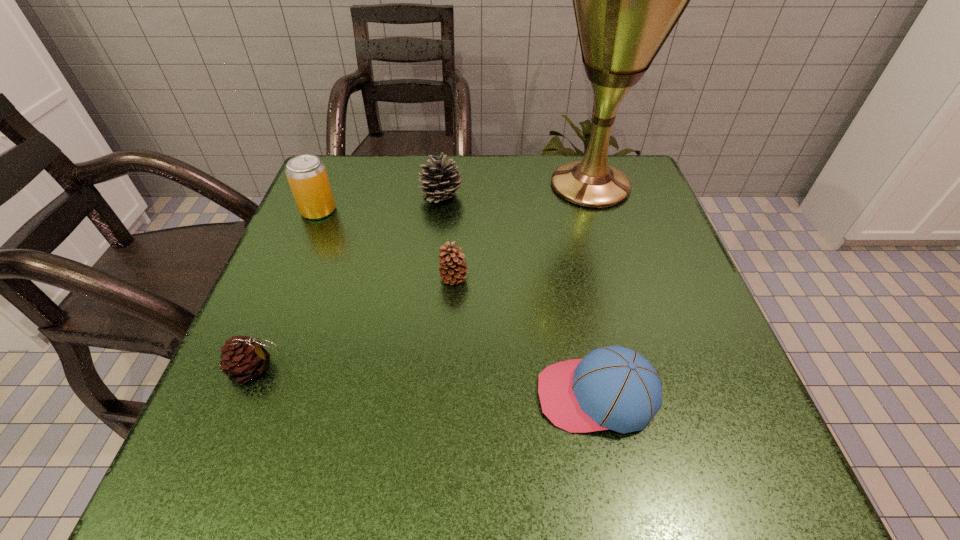
Identify the location of pop (soda) located in the left edge section of the desktop. (307, 176).

You are a GUI agent. You are given a task and a screenshot of the screen. Output one action in this format:
    pyautogui.click(x=<x>, y=<y>)
    Task: Click on the pinecone situated at the left edge
    The width and height of the screenshot is (960, 540).
    Given the screenshot: What is the action you would take?
    pyautogui.click(x=243, y=358)

This screenshot has height=540, width=960. In order to click on trophy cup at the right edge in this screenshot , I will do `click(627, 0)`.

What are the coordinates of `baseball cap present at the right edge` in the screenshot? It's located at (613, 387).

You are a GUI agent. You are given a task and a screenshot of the screen. Output one action in this format:
    pyautogui.click(x=<x>, y=<y>)
    Task: Click on the object present at the far left corner
    This screenshot has width=960, height=540.
    Given the screenshot: What is the action you would take?
    pyautogui.click(x=307, y=176)

Where is `object that is positioned at the far right corner`? Image resolution: width=960 pixels, height=540 pixels. object that is positioned at the far right corner is located at coordinates (627, 0).

The height and width of the screenshot is (540, 960). I want to click on object that is at the near right corner, so click(613, 387).

Locate an element on the screen. free space at the far edge of the desktop is located at coordinates (504, 161).

The width and height of the screenshot is (960, 540). I want to click on vacant space at the near edge, so click(414, 427).

In the image, there is a desktop. Identify the location of vacant space at the left edge. (341, 245).